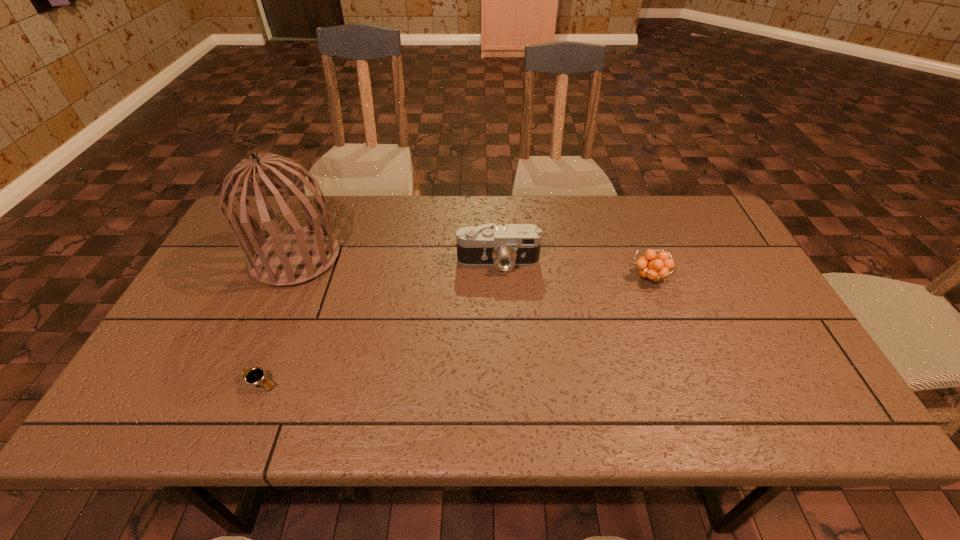
Where is `vacant space that is in between the birdcage and the watch`? This screenshot has width=960, height=540. vacant space that is in between the birdcage and the watch is located at coordinates (277, 320).

The image size is (960, 540). In order to click on vacant space in between the birdcage and the camera in this screenshot , I will do `click(397, 260)`.

The image size is (960, 540). I want to click on blank region between the shortest object and the birdcage, so click(277, 320).

Where is `free space that is in between the second shortest object and the birdcage`? free space that is in between the second shortest object and the birdcage is located at coordinates (472, 267).

Locate an element on the screen. vacant area that lies between the second tallest object and the nearest object is located at coordinates (379, 322).

This screenshot has height=540, width=960. Identify the location of unoccupied position between the watch and the rightmost object. (454, 330).

You are a GUI agent. You are given a task and a screenshot of the screen. Output one action in this format:
    pyautogui.click(x=<x>, y=<y>)
    Task: Click on the unoccupied position between the second object from right to left and the shortest object
    The height and width of the screenshot is (540, 960).
    Given the screenshot: What is the action you would take?
    pyautogui.click(x=379, y=322)

At what (x,y) coordinates should I click in order to perform the action: click on vacant region between the tallest object and the nearest object. Please return your answer as a coordinate pair (x, y). The height and width of the screenshot is (540, 960). Looking at the image, I should click on (277, 320).

Find the location of a particular element. The height and width of the screenshot is (540, 960). vacant area that lies between the third object from left to right and the orange fruit is located at coordinates (574, 269).

Where is `vacant area that lies between the birdcage and the camera`? This screenshot has width=960, height=540. vacant area that lies between the birdcage and the camera is located at coordinates (397, 260).